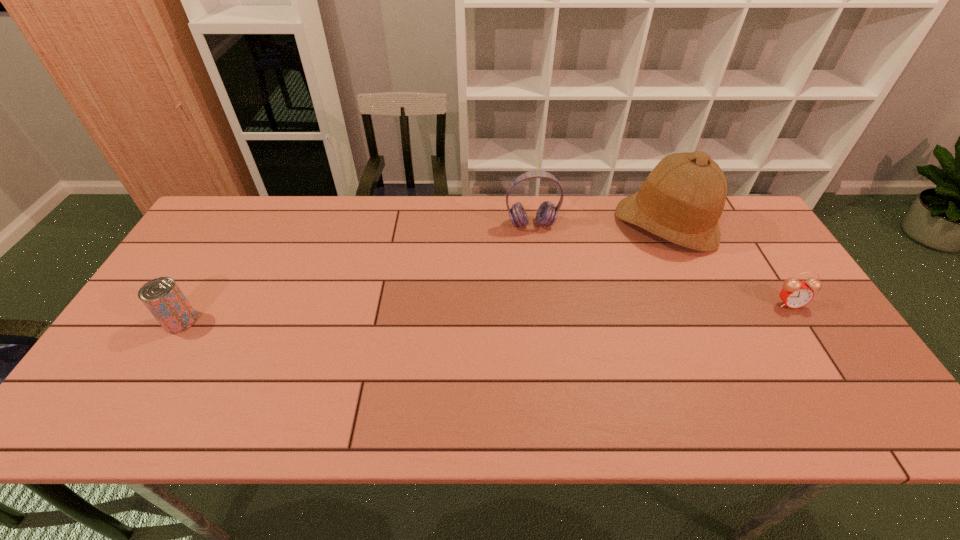
You are a GUI agent. You are given a task and a screenshot of the screen. Output one action in this format:
    pyautogui.click(x=<x>, y=<y>)
    Task: Click on the free space on the desktop that is between the leftmost object and the alarm clock and is positioned on the headband and ear cups of the second tallest object
    The width and height of the screenshot is (960, 540).
    Given the screenshot: What is the action you would take?
    pyautogui.click(x=550, y=310)

Find the location of a particular element. The image size is (960, 540). free spot on the desktop that is between the leftmost object and the rightmost object and is positioned on the front-facing side of the hat is located at coordinates (568, 310).